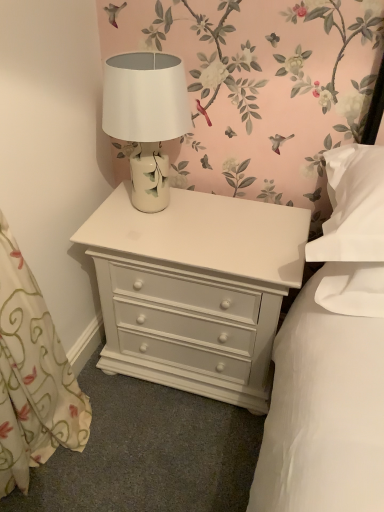
Locate an element on the screen. The width and height of the screenshot is (384, 512). free space in front of white ceramic table lamp at center is located at coordinates (164, 241).